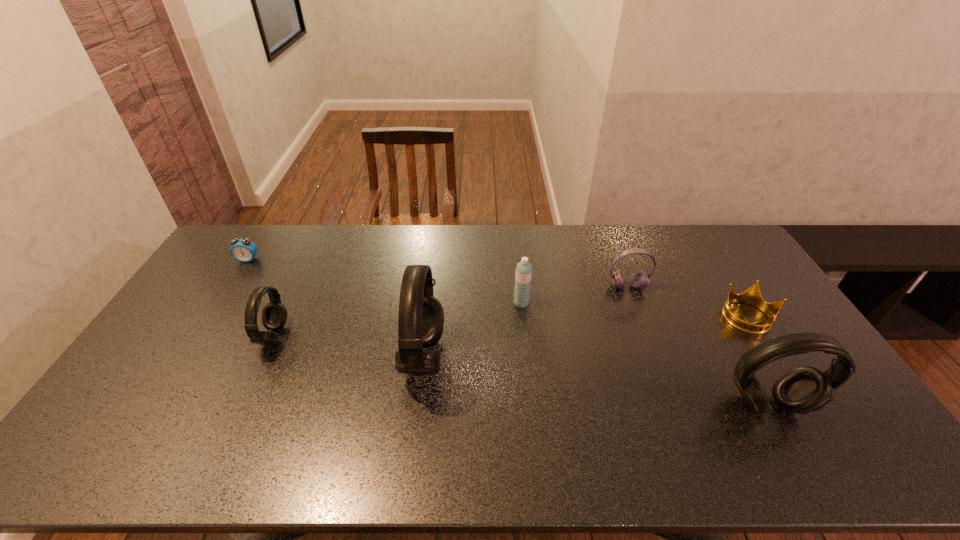
The image size is (960, 540). What are the coordinates of `object situated at the far edge` in the screenshot? It's located at (243, 250).

In order to click on object present at the left edge in this screenshot , I will do `click(243, 250)`.

Identify the location of headset that is positioned at the right edge. (803, 390).

Find the location of a particular element. The image size is (960, 540). crown that is at the right edge is located at coordinates (752, 296).

The image size is (960, 540). Identify the location of object at the far left corner. (243, 250).

Identify the location of object that is at the near right corner. Image resolution: width=960 pixels, height=540 pixels. (803, 390).

Locate an element on the screen. This screenshot has height=540, width=960. vacant space at the far edge of the desktop is located at coordinates (433, 252).

In the image, there is a desktop. Where is `vacant space at the near edge`? vacant space at the near edge is located at coordinates (709, 408).

The width and height of the screenshot is (960, 540). Identify the location of free spot at the left edge of the desktop. (201, 281).

Identify the location of vacant space at the far right corner of the desktop. (702, 235).